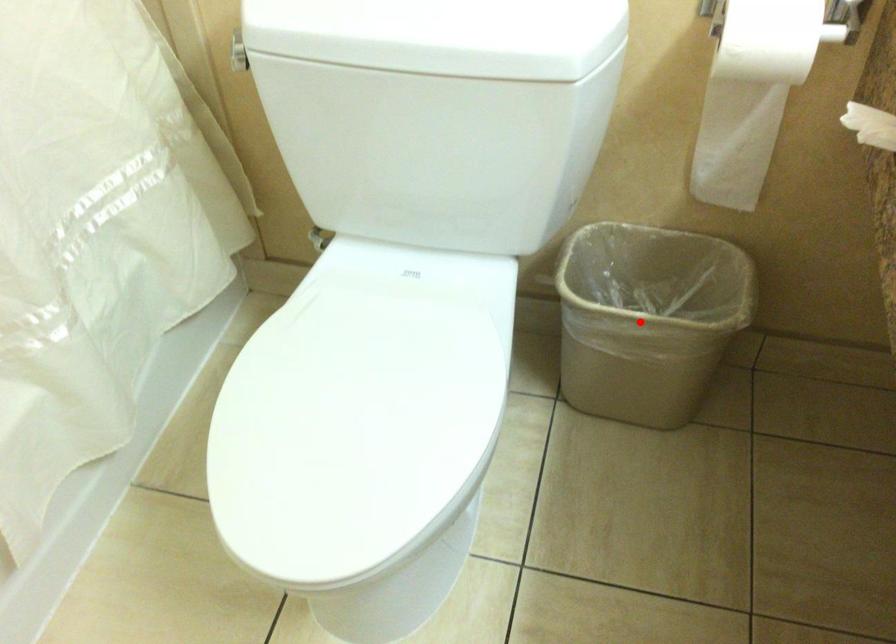
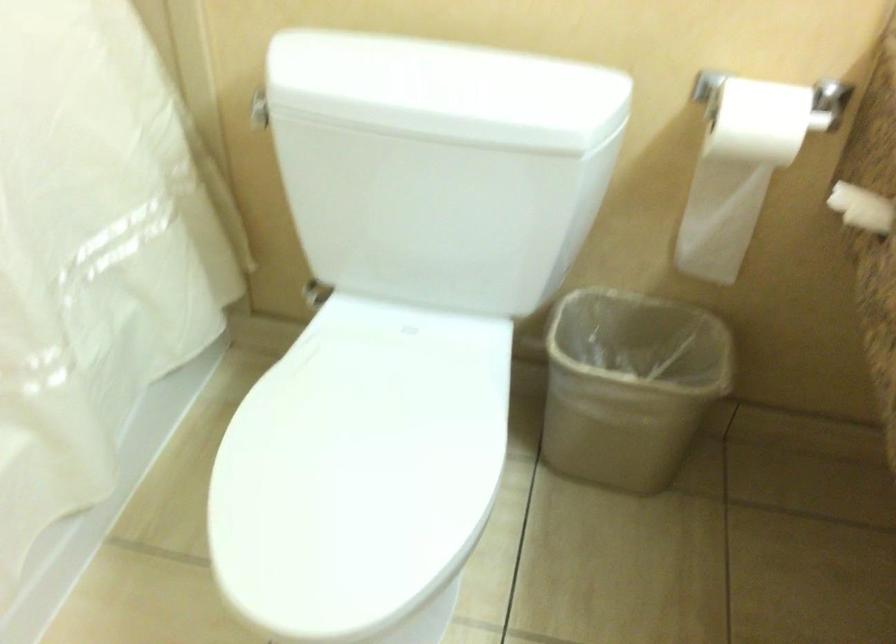
Locate, in the second image, the point that corresponds to the highlighted location in the first image.

(629, 384)